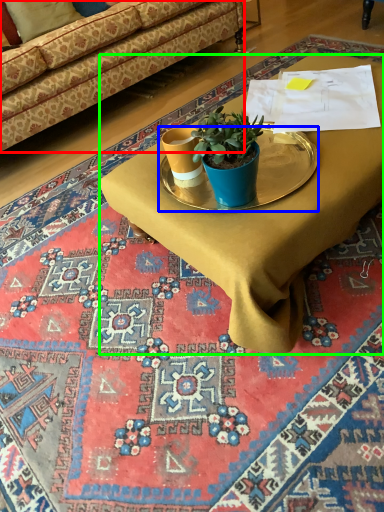
Question: Which is nearer to the studio couch (highlighted by a red box)? round table (highlighted by a blue box) or desk (highlighted by a green box).

Choices:
 (A) round table
 (B) desk

Answer: (B)